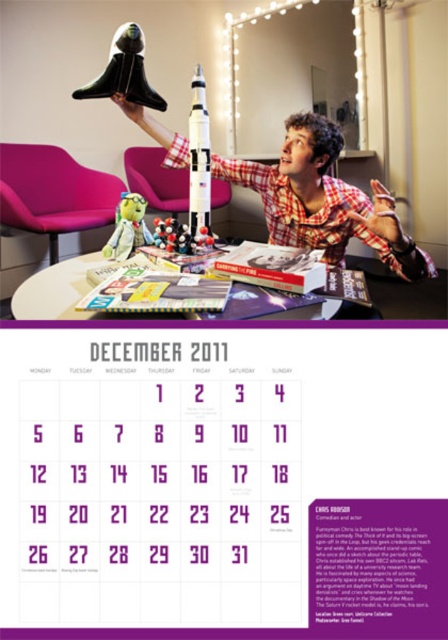
You are a visitor at a model rocket exhibition. You see the black matte rocket ship at upper center and the green plush toy at center. Which object is placed higher in the image?

The black matte rocket ship at upper center is positioned over the green plush toy at center, so it is higher.

You are a tailor measuring clothing for a customer. You notice the plaid shirt at upper center and the black matte rocket ship at upper center in the image. Which item has a greater width that requires more fabric?

The plaid shirt at upper center has a greater width than the black matte rocket ship at upper center, so it requires more fabric.